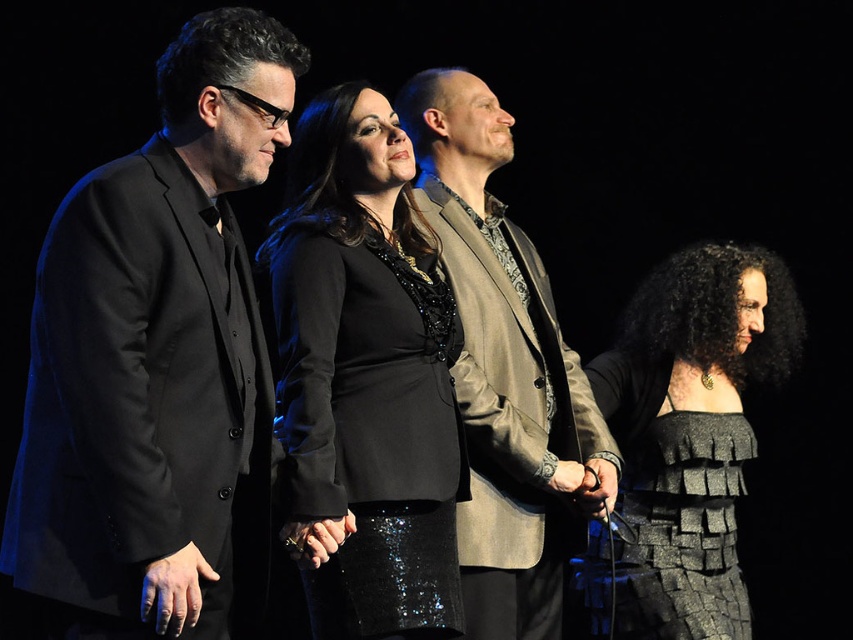
Does shiny metallic dress at center have a larger size compared to textured gray dress at lower right?

Yes.

This screenshot has width=853, height=640. What are the coordinates of `shiny metallic dress at center` in the screenshot? It's located at (688, 438).

Does shiny beige suit at center appear on the left side of textured gray dress at lower right?

Yes, shiny beige suit at center is to the left of textured gray dress at lower right.

Does shiny beige suit at center have a greater height compared to textured gray dress at lower right?

Correct, shiny beige suit at center is much taller as textured gray dress at lower right.

Does point (486, 243) come closer to viewer compared to point (665, 616)?

Yes, point (486, 243) is in front of point (665, 616).

In order to click on shiny beige suit at center in this screenshot , I will do `click(505, 372)`.

Can you confirm if shiny beige suit at center is bigger than shiny metallic dress at center?

No.

Is point (471, 416) in front of point (680, 477)?

Yes, point (471, 416) is in front of point (680, 477).

Find the location of `shiny beige suit at center`. shiny beige suit at center is located at coordinates (505, 372).